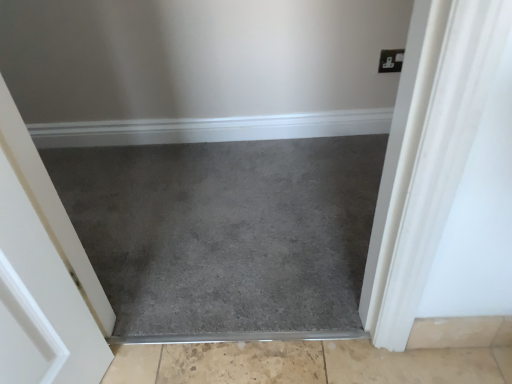
Question: From the image's perspective, is beige textured concrete at bottom, the 1th concrete in the bottom-to-top sequence, above or below slate carpet at center?

Choices:
 (A) above
 (B) below

Answer: (B)

Question: Is beige textured concrete at bottom, the 1th concrete in the bottom-to-top sequence, situated inside slate carpet at center or outside?

Choices:
 (A) inside
 (B) outside

Answer: (B)

Question: Which of these objects is positioned closest to the beige textured concrete at bottom, the 1th concrete in the bottom-to-top sequence?

Choices:
 (A) beige tile at lower right, the 1th concrete in the top-to-bottom sequence
 (B) slate carpet at center

Answer: (A)

Question: Considering the real-world distances, which object is farthest from the beige tile at lower right, which ranks as the second concrete in bottom-to-top order?

Choices:
 (A) slate carpet at center
 (B) beige textured concrete at bottom, the 1th concrete in the bottom-to-top sequence

Answer: (A)